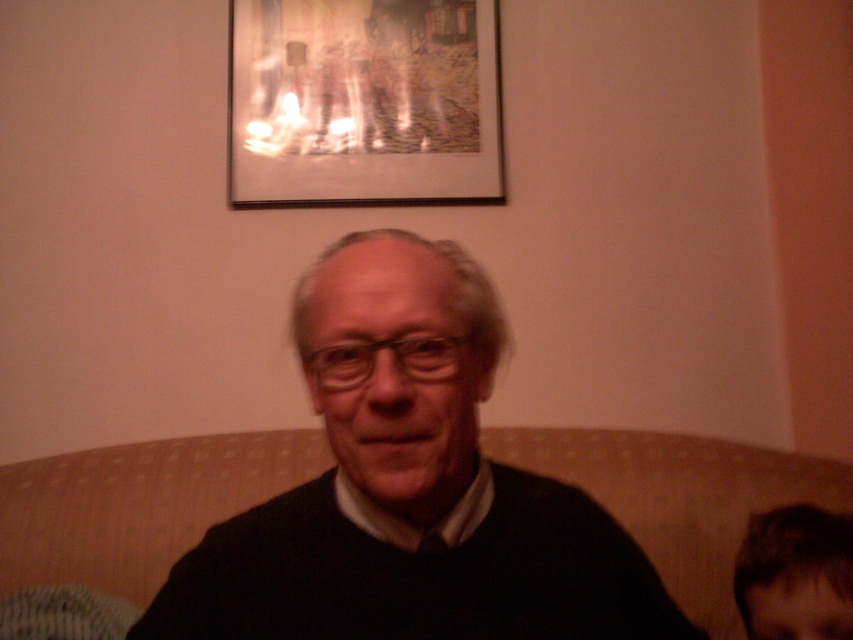
Measure the distance between beige fabric couch at center and dark brown hair at lower right.

The distance of beige fabric couch at center from dark brown hair at lower right is 28.39 inches.

Is point (247, 442) farther from viewer compared to point (763, 579)?

Yes, it is behind point (763, 579).

Where is `beige fabric couch at center`? This screenshot has width=853, height=640. beige fabric couch at center is located at coordinates (137, 504).

Which is behind, point (614, 548) or point (840, 529)?

The point (840, 529) is behind.

Is black matte sweater at center further to camera compared to dark brown hair at lower right?

No.

Is point (488, 621) in front of point (787, 589)?

Yes, point (488, 621) is in front of point (787, 589).

Image resolution: width=853 pixels, height=640 pixels. Find the location of `black matte sweater at center`. black matte sweater at center is located at coordinates (409, 486).

Measure the distance between beige fabric couch at center and wooden picture frame at upper center.

37.66 inches

Which is in front, point (259, 481) or point (502, 176)?

Positioned in front is point (259, 481).

The width and height of the screenshot is (853, 640). What do you see at coordinates (137, 504) in the screenshot?
I see `beige fabric couch at center` at bounding box center [137, 504].

Locate an element on the screen. Image resolution: width=853 pixels, height=640 pixels. beige fabric couch at center is located at coordinates (137, 504).